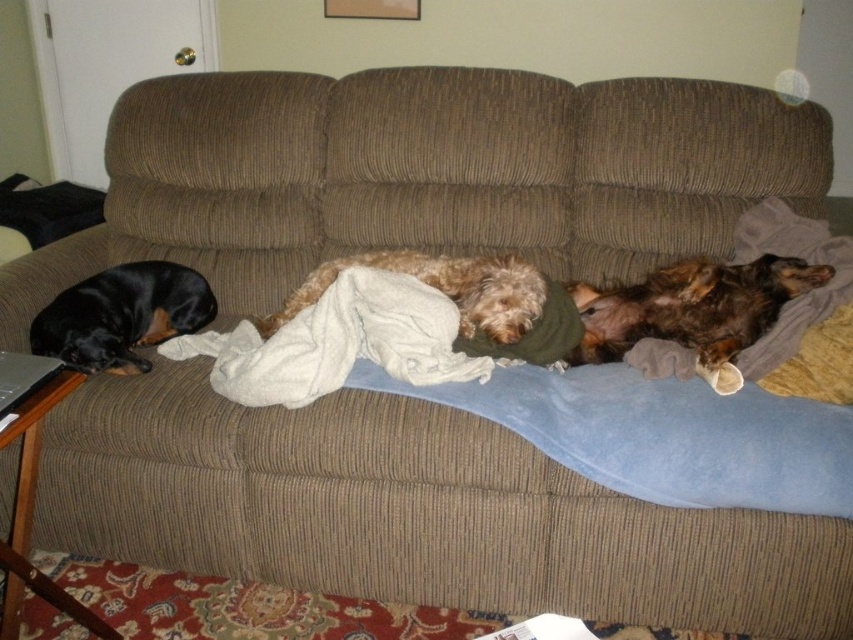
Which is behind, point (753, 305) or point (187, 332)?

Point (187, 332)

Which is more to the right, brown shaggy dog at right or black smooth dog at left?

Positioned to the right is brown shaggy dog at right.

The height and width of the screenshot is (640, 853). What do you see at coordinates (692, 307) in the screenshot?
I see `brown shaggy dog at right` at bounding box center [692, 307].

At what (x,y) coordinates should I click in order to perform the action: click on brown shaggy dog at right. Please return your answer as a coordinate pair (x, y). Looking at the image, I should click on pos(692,307).

Is black smooth dog at left in front of fuzzy brown dog at center?

No, black smooth dog at left is behind fuzzy brown dog at center.

From the picture: Can you confirm if black smooth dog at left is positioned to the left of fuzzy brown dog at center?

Yes, black smooth dog at left is to the left of fuzzy brown dog at center.

Which is behind, point (125, 273) or point (525, 282)?

Point (125, 273)

The width and height of the screenshot is (853, 640). Identify the location of black smooth dog at left. (120, 316).

Is brown shaggy dog at right thinner than fuzzy brown dog at center?

Yes.

Does brown shaggy dog at right lie behind fuzzy brown dog at center?

Yes.

Is point (737, 268) farther from viewer compared to point (483, 266)?

Yes, it is behind point (483, 266).

The image size is (853, 640). In order to click on brown shaggy dog at right in this screenshot , I will do `click(692, 307)`.